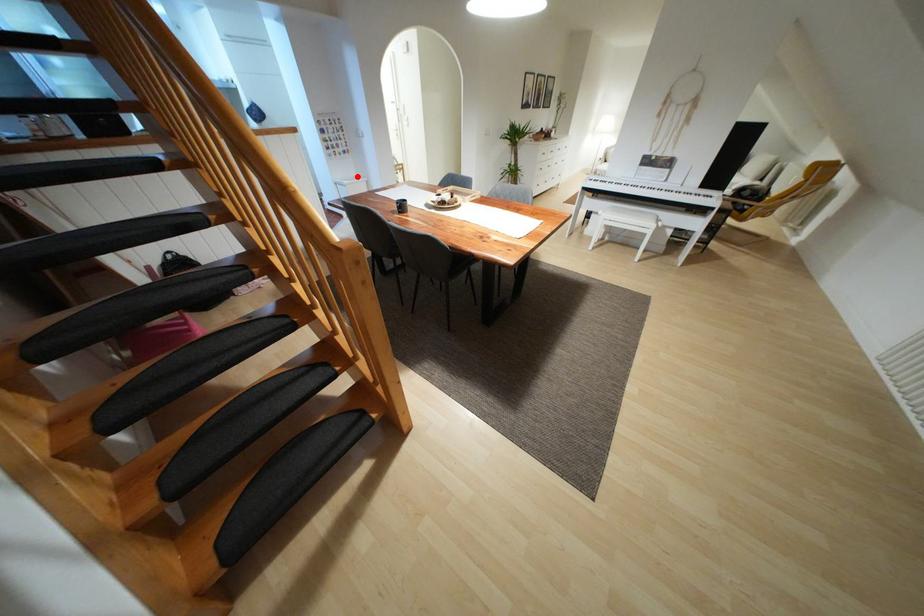
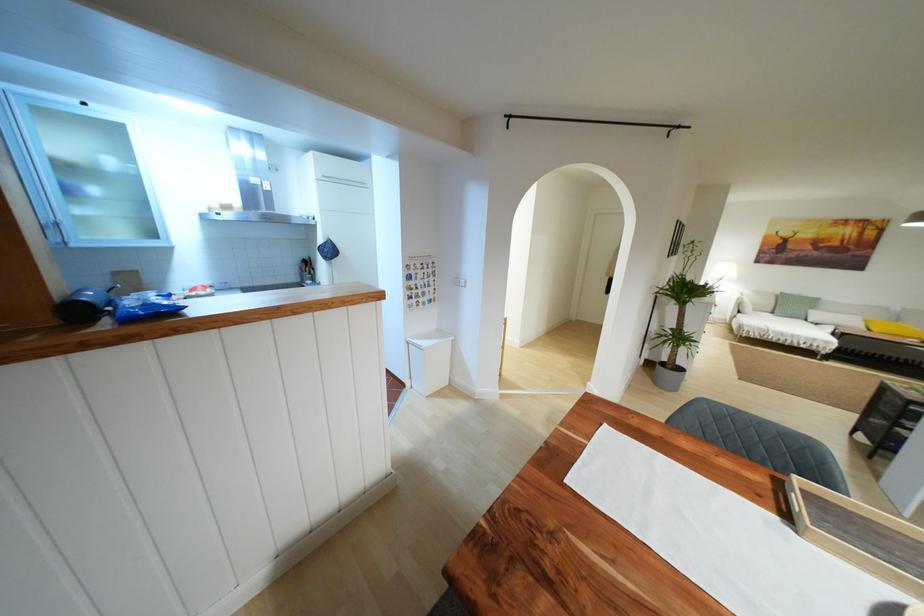
Question: I am providing you with two images of the same scene from different viewpoints. Image1 has a red point marked. In image2, the corresponding 3D location appears at what relative position? Reply with the corresponding letter.

Choices:
 (A) Closer
 (B) Farther

Answer: (A)